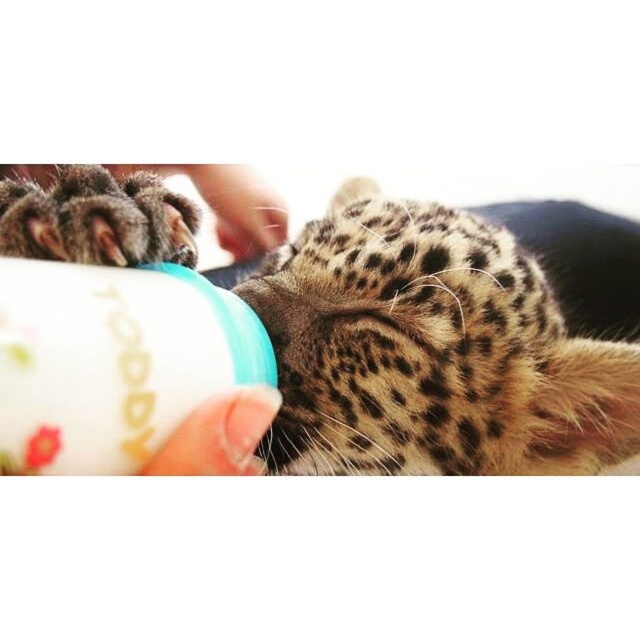
Between spotted fur leopard at center and white plastic bottle at center, which one is positioned higher?

white plastic bottle at center is above.

Between spotted fur leopard at center and white plastic bottle at center, which one is positioned lower?

Positioned lower is spotted fur leopard at center.

The width and height of the screenshot is (640, 640). Describe the element at coordinates (432, 349) in the screenshot. I see `spotted fur leopard at center` at that location.

Locate an element on the screen. spotted fur leopard at center is located at coordinates (432, 349).